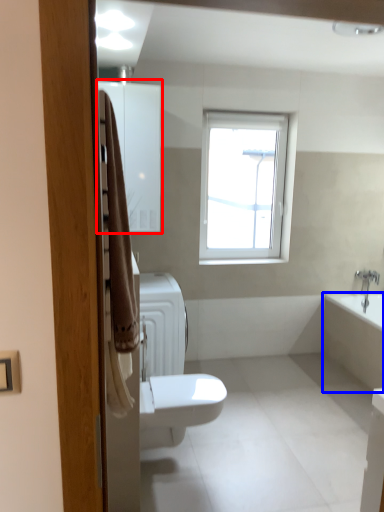
Question: Which object appears farthest to the camera in this image, medicine cabinet (highlighted by a red box) or bath (highlighted by a blue box)?

Choices:
 (A) medicine cabinet
 (B) bath

Answer: (B)